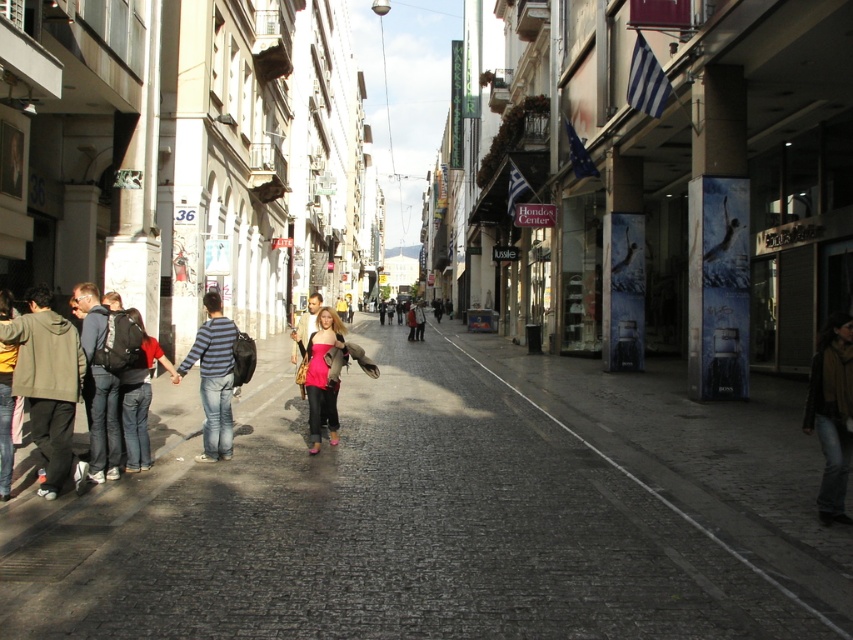
Who is positioned more to the right, gray cobblestone pavement at center or matte pink dress at center?

Positioned to the right is gray cobblestone pavement at center.

Who is higher up, gray cobblestone pavement at center or matte pink dress at center?

matte pink dress at center is higher up.

What do you see at coordinates (445, 509) in the screenshot?
I see `gray cobblestone pavement at center` at bounding box center [445, 509].

Where is `gray cobblestone pavement at center`? The height and width of the screenshot is (640, 853). gray cobblestone pavement at center is located at coordinates (445, 509).

Between matte pink dress at center and denim jacket at left, which one appears on the right side from the viewer's perspective?

matte pink dress at center

Does matte pink dress at center have a lesser width compared to denim jacket at left?

No, matte pink dress at center is not thinner than denim jacket at left.

Does point (321, 362) lie behind point (16, 346)?

Yes, it is.

Where is `matte pink dress at center`? matte pink dress at center is located at coordinates (322, 376).

Is green matte jacket at left further to camera compared to matte pink dress at center?

That is False.

Is green matte jacket at left to the left of matte pink dress at center from the viewer's perspective?

Yes, green matte jacket at left is to the left of matte pink dress at center.

Who is more distant from viewer, (67, 323) or (332, 422)?

The point (332, 422) is more distant.

Identify the location of green matte jacket at left. The image size is (853, 640). (48, 385).